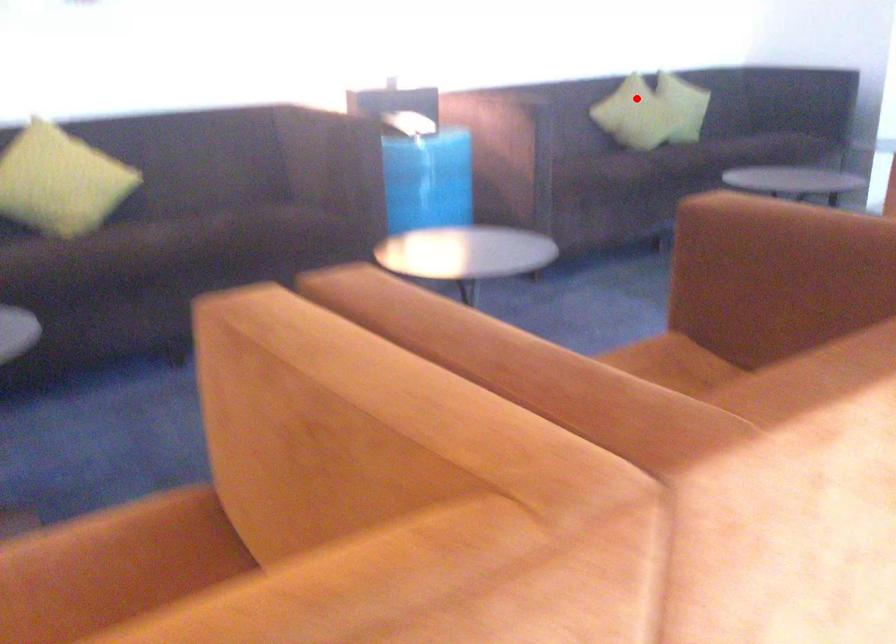
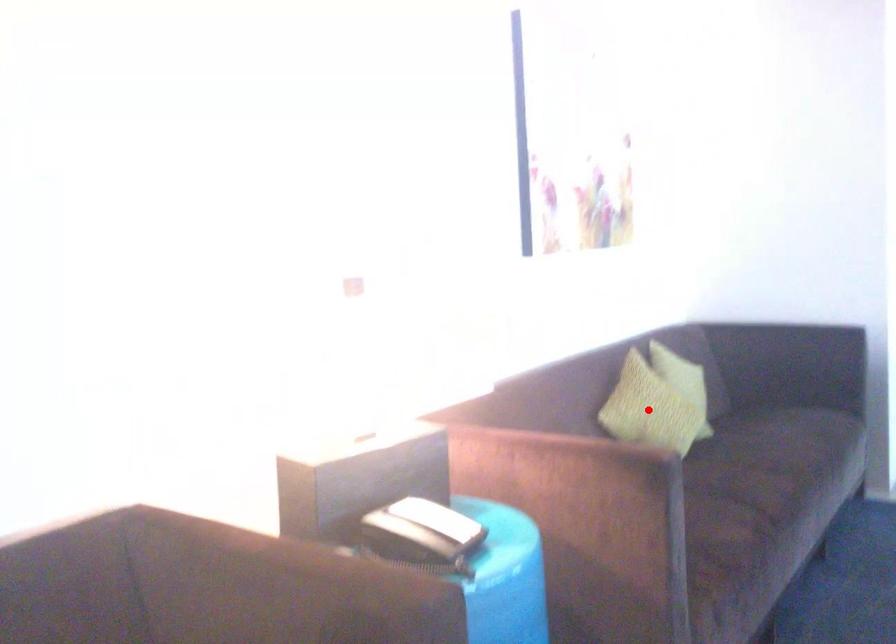
I am providing you with two images of the same scene from different viewpoints. A red point is marked on the first image and another point is marked on the second image. Is the red point in image1 aligned with the point shown in image2?

Yes